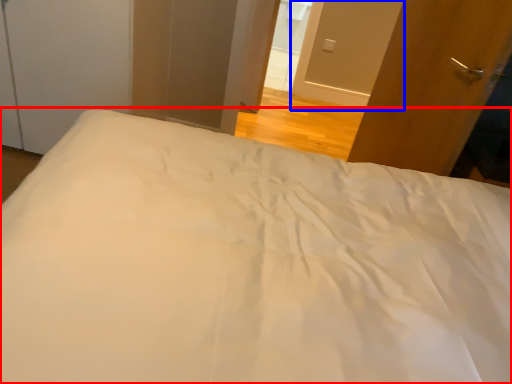
Question: Which of the following is the farthest to the observer, bed (highlighted by a red box) or screen door (highlighted by a blue box)?

Choices:
 (A) bed
 (B) screen door

Answer: (B)